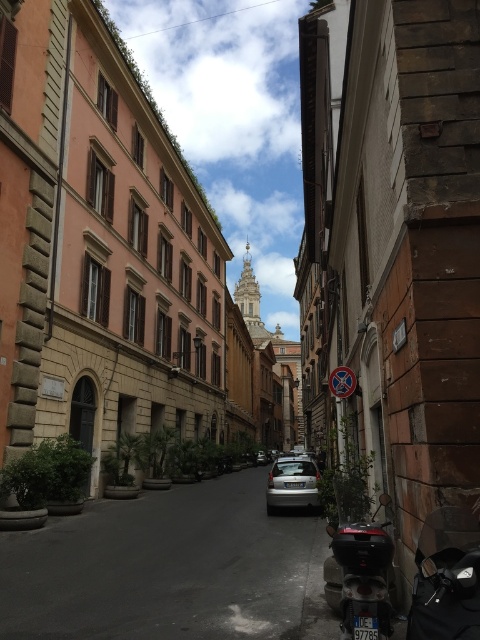
Question: Can you confirm if silver metallic car at center is smaller than satin silver sedan at center?

Choices:
 (A) yes
 (B) no

Answer: (B)

Question: Does silver metallic car at center have a greater width compared to metallic red scooter at lower right?

Choices:
 (A) yes
 (B) no

Answer: (A)

Question: Considering the real-world distances, which object is farthest from the satin silver sedan at center?

Choices:
 (A) shiny black motorcycle at lower right
 (B) metallic red scooter at lower right
 (C) silver metallic car at center

Answer: (A)

Question: Can you confirm if shiny black motorcycle at lower right is positioned to the right of metallic red scooter at lower right?

Choices:
 (A) no
 (B) yes

Answer: (B)

Question: Which object appears farthest from the camera in this image?

Choices:
 (A) metallic red scooter at lower right
 (B) shiny black motorcycle at lower right
 (C) silver metallic car at center

Answer: (C)

Question: Which of these objects is positioned farthest from the shiny black motorcycle at lower right?

Choices:
 (A) satin silver sedan at center
 (B) silver metallic car at center
 (C) metallic red scooter at lower right

Answer: (A)